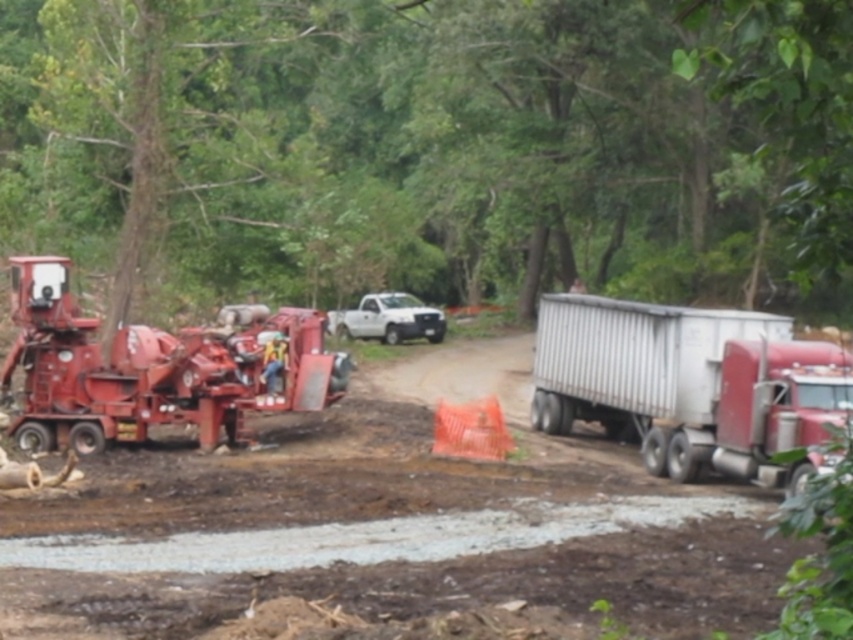
Question: Which of the following is the closest to the observer?

Choices:
 (A) orange safety vest at center
 (B) white matte truck at center
 (C) matte red construction equipment at left

Answer: (C)

Question: Can you confirm if white matte truck at center is bigger than orange safety vest at center?

Choices:
 (A) no
 (B) yes

Answer: (B)

Question: Which is nearer to the orange safety vest at center?

Choices:
 (A) matte red construction equipment at left
 (B) white matte truck at center
 (C) white metallic trailer truck at right
 (D) brushed metal truck at center

Answer: (A)

Question: Estimate the real-world distances between objects in this image. Which object is closer to the orange safety vest at center?

Choices:
 (A) white matte truck at center
 (B) brushed metal truck at center

Answer: (B)

Question: Is white metallic trailer truck at right above orange safety vest at center?

Choices:
 (A) no
 (B) yes

Answer: (A)

Question: Is matte red construction equipment at left wider than orange safety vest at center?

Choices:
 (A) no
 (B) yes

Answer: (B)